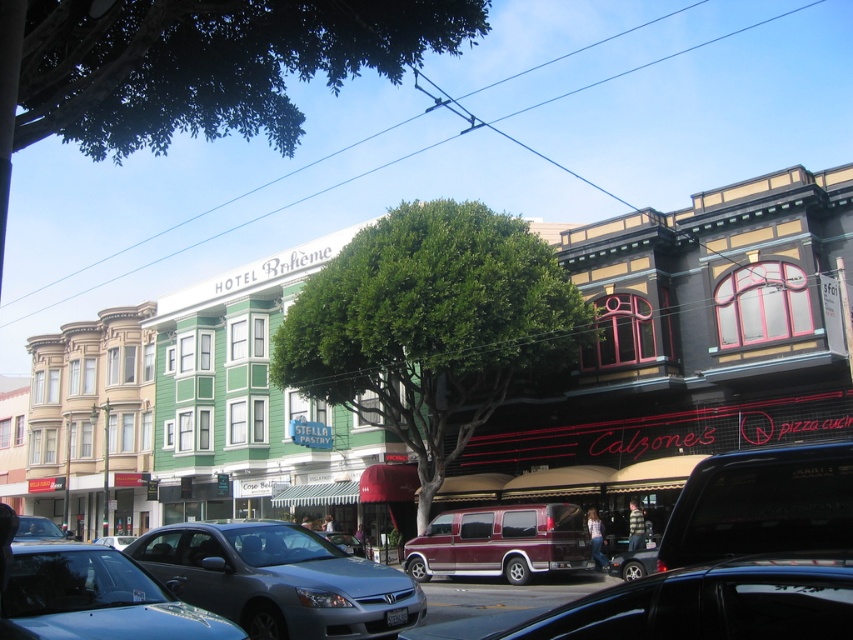
You are a delivery driver who needs to park your metallic gray sedan at lower left under some shade to avoid the heat. Is there a suitable spot under the green leafy tree at upper center that can accommodate your vehicle?

The green leafy tree at upper center is much taller than the metallic gray sedan at lower left, so it likely provides sufficient shade. However, the description does not specify the width or spread of the tree canopy, so it is uncertain if the metallic gray sedan at lower left can fit under it.

Consider the image. You are a pedestrian standing at the crosswalk near the metallic gray sedan at lower left. You want to take a photo of the green leafy tree at upper center without any obstructions. Which direction should you move to get a clear view?

The green leafy tree at upper center is to the left of the metallic gray sedan at lower left. To avoid the sedan obstructing the view, you should move to the right side of the sedan to capture the tree without any blockage.

You are a pedestrian standing on the sidewalk and want to cross the street. There is a satin silver sedan at lower center and a maroon metallic van at center in your path. Which vehicle should you avoid first to safely cross?

The satin silver sedan at lower center is closer to the viewer than the maroon metallic van at center, so you should avoid the satin silver sedan at lower center first to safely cross.